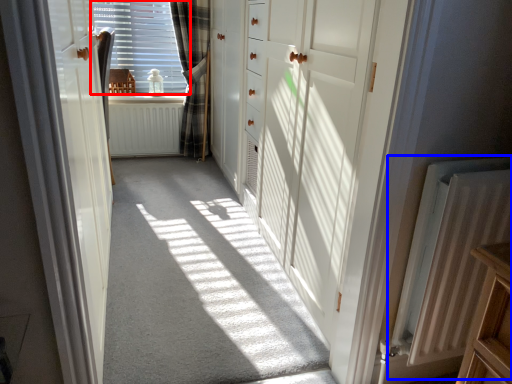
Question: Which object is closer to the camera taking this photo, window (highlighted by a red box) or radiator (highlighted by a blue box)?

Choices:
 (A) window
 (B) radiator

Answer: (B)